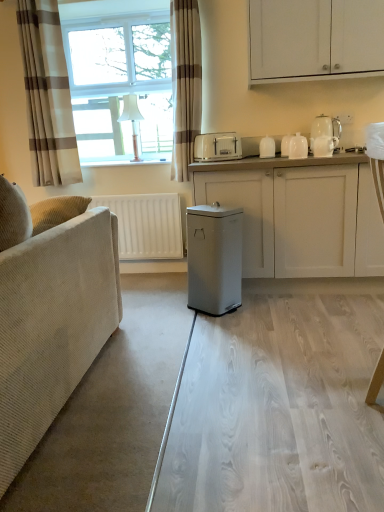
Question: Does point (312, 131) appear closer or farther from the camera than point (299, 141)?

Choices:
 (A) closer
 (B) farther

Answer: (A)

Question: From the image's perspective, is white glossy coffee machine at upper right positioned above or below white glossy jar at upper right, acting as the 3th appliance starting from the left?

Choices:
 (A) above
 (B) below

Answer: (A)

Question: Which of these objects is positioned closest to the beige plaid curtain at upper left, positioned as the second curtain in left-to-right order?

Choices:
 (A) white matte cabinet at center, positioned as the 1th cabinetry in bottom-to-top order
 (B) white matte radiator at left
 (C) metallic gray trash can at center
 (D) transparent glass table at center
 (E) white glossy coffee machine at upper right

Answer: (B)

Question: Based on their relative distances, which object is nearer to the white plastic toaster at center, the first appliance from the left?

Choices:
 (A) beige corduroy couch at left
 (B) beige plaid curtain at upper left, which ranks as the 2th curtain in right-to-left order
 (C) metallic gray trash can at center
 (D) white glossy teapot at upper right, which is the 2th appliance from left to right
 (E) white glossy cups at upper right, arranged as the first appliance when viewed from the right

Answer: (D)